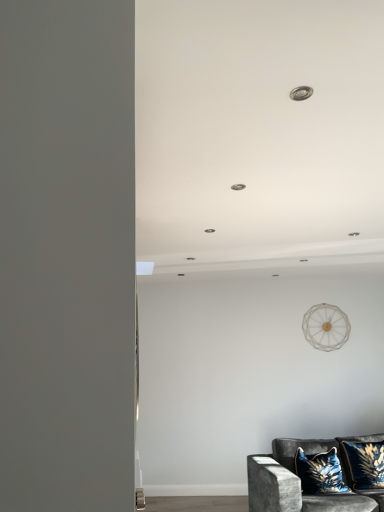
Question: Considering the relative sizes of velvet blue pillow at lower right, marked as the first pillow in a left-to-right arrangement, and velvet dark gray couch at lower right in the image provided, is velvet blue pillow at lower right, marked as the first pillow in a left-to-right arrangement, taller than velvet dark gray couch at lower right?

Choices:
 (A) no
 (B) yes

Answer: (A)

Question: Does velvet blue pillow at lower right, the 2th pillow positioned from the right, have a greater width compared to velvet dark gray couch at lower right?

Choices:
 (A) no
 (B) yes

Answer: (A)

Question: Would you say velvet blue pillow at lower right, marked as the first pillow in a left-to-right arrangement, contains velvet dark gray couch at lower right?

Choices:
 (A) no
 (B) yes

Answer: (A)

Question: Is velvet blue pillow at lower right, the 2th pillow positioned from the right, thinner than velvet dark gray couch at lower right?

Choices:
 (A) yes
 (B) no

Answer: (A)

Question: From the image's perspective, is velvet blue pillow at lower right, the 2th pillow positioned from the right, above velvet dark gray couch at lower right?

Choices:
 (A) yes
 (B) no

Answer: (A)

Question: Considering the positions of velvet blue pillow at lower right, marked as the first pillow in a left-to-right arrangement, and velvet dark gray couch at lower right in the image, is velvet blue pillow at lower right, marked as the first pillow in a left-to-right arrangement, taller or shorter than velvet dark gray couch at lower right?

Choices:
 (A) short
 (B) tall

Answer: (A)

Question: Does point (324, 463) appear closer or farther from the camera than point (337, 444)?

Choices:
 (A) closer
 (B) farther

Answer: (A)

Question: Would you say velvet blue pillow at lower right, marked as the first pillow in a left-to-right arrangement, is to the left or to the right of velvet dark gray couch at lower right in the picture?

Choices:
 (A) left
 (B) right

Answer: (A)

Question: Based on their sizes in the image, would you say velvet blue pillow at lower right, the 2th pillow positioned from the right, is bigger or smaller than velvet dark gray couch at lower right?

Choices:
 (A) big
 (B) small

Answer: (B)

Question: Is velvet dark gray couch at lower right to the left or to the right of velvet blue pillow at lower right, the 2th pillow positioned from the right, in the image?

Choices:
 (A) left
 (B) right

Answer: (B)

Question: Does point (274, 461) appear closer or farther from the camera than point (306, 476)?

Choices:
 (A) farther
 (B) closer

Answer: (A)

Question: Do you think velvet dark gray couch at lower right is within velvet blue pillow at lower right, marked as the first pillow in a left-to-right arrangement, or outside of it?

Choices:
 (A) inside
 (B) outside

Answer: (B)

Question: In the image, is velvet dark gray couch at lower right positioned in front of or behind velvet blue pillow at lower right, marked as the first pillow in a left-to-right arrangement?

Choices:
 (A) front
 (B) behind

Answer: (A)

Question: Is velvet blue pillow at lower right, placed as the first pillow when sorted from right to left, wider or thinner than velvet blue pillow at lower right, marked as the first pillow in a left-to-right arrangement?

Choices:
 (A) wide
 (B) thin

Answer: (B)

Question: From a real-world perspective, is velvet blue pillow at lower right, which appears as the 2th pillow when viewed from the left, above or below velvet blue pillow at lower right, the 2th pillow positioned from the right?

Choices:
 (A) below
 (B) above

Answer: (B)